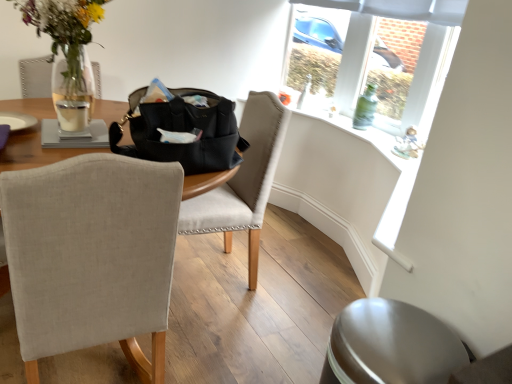
Question: Could you tell me if beige fabric chair at left, marked as the 2th chair in a back-to-front arrangement, is turned towards green glass bottle at upper right?

Choices:
 (A) yes
 (B) no

Answer: (B)

Question: Is beige fabric chair at left, the first chair viewed from the front, next to green glass bottle at upper right?

Choices:
 (A) no
 (B) yes

Answer: (A)

Question: From the image's perspective, is beige fabric chair at left, the first chair viewed from the front, located above green glass bottle at upper right?

Choices:
 (A) yes
 (B) no

Answer: (B)

Question: From a real-world perspective, does beige fabric chair at left, the first chair viewed from the front, stand above green glass bottle at upper right?

Choices:
 (A) no
 (B) yes

Answer: (A)

Question: Does beige fabric chair at left, the first chair viewed from the front, have a larger size compared to green glass bottle at upper right?

Choices:
 (A) no
 (B) yes

Answer: (B)

Question: Is beige fabric chair at left, the first chair viewed from the front, smaller than green glass bottle at upper right?

Choices:
 (A) yes
 (B) no

Answer: (B)

Question: Is black leather handbag at center not close to white matte candle at table left?

Choices:
 (A) no
 (B) yes

Answer: (A)

Question: Is black leather handbag at center oriented towards white matte candle at table left?

Choices:
 (A) yes
 (B) no

Answer: (B)

Question: Is the position of black leather handbag at center less distant than that of white matte candle at table left?

Choices:
 (A) yes
 (B) no

Answer: (A)

Question: From a real-world perspective, does black leather handbag at center stand above white matte candle at table left?

Choices:
 (A) yes
 (B) no

Answer: (A)

Question: Is the surface of black leather handbag at center in direct contact with white matte candle at table left?

Choices:
 (A) no
 (B) yes

Answer: (A)

Question: From the image's perspective, is black leather handbag at center on white matte candle at table left?

Choices:
 (A) no
 (B) yes

Answer: (A)

Question: From a real-world perspective, is black leather handbag at center physically above green glass bottle at upper right?

Choices:
 (A) yes
 (B) no

Answer: (A)